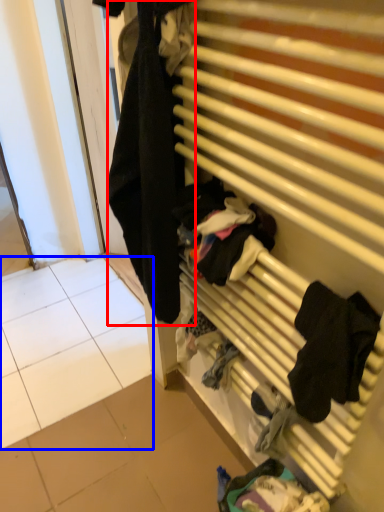
Question: Which of the following is the closest to the observer, clothing (highlighted by a red box) or tile (highlighted by a blue box)?

Choices:
 (A) clothing
 (B) tile

Answer: (A)